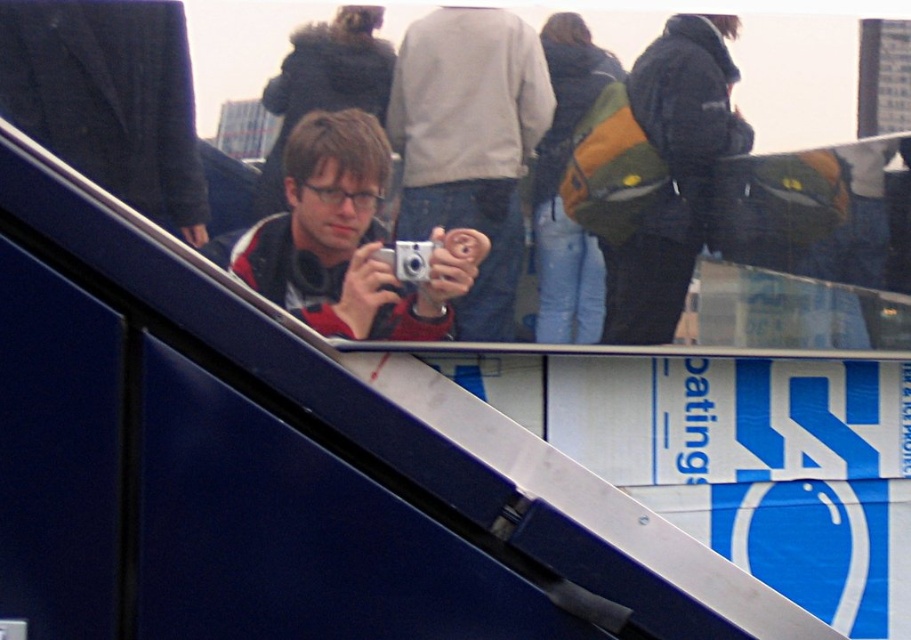
Question: Which point appears farthest from the camera in this image?

Choices:
 (A) (479, 278)
 (B) (415, 248)

Answer: (A)

Question: Is dark blue jacket at upper right further to camera compared to silver metallic camera at center?

Choices:
 (A) yes
 (B) no

Answer: (A)

Question: Is matte black camera at center above silver metallic camera at center?

Choices:
 (A) yes
 (B) no

Answer: (A)

Question: Which object is the farthest from the dark blue jacket at upper right?

Choices:
 (A) matte gray sweater at center
 (B) matte black camera at center
 (C) silver metallic camera at center

Answer: (C)

Question: Is matte black camera at center positioned behind dark blue jacket at upper right?

Choices:
 (A) yes
 (B) no

Answer: (B)

Question: Which point is closer to the camera?

Choices:
 (A) silver metallic camera at center
 (B) matte gray sweater at center

Answer: (B)